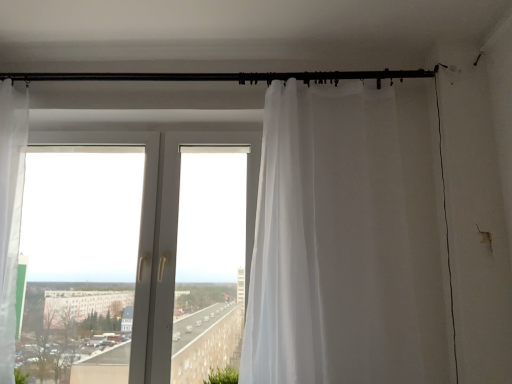
Question: Would you consider sheer white curtain at right to be distant from black metal rod at upper center?

Choices:
 (A) yes
 (B) no

Answer: (B)

Question: Can you confirm if sheer white curtain at right is smaller than black metal rod at upper center?

Choices:
 (A) yes
 (B) no

Answer: (B)

Question: Is sheer white curtain at right beside black metal rod at upper center?

Choices:
 (A) yes
 (B) no

Answer: (B)

Question: From the image's perspective, is sheer white curtain at right on top of black metal rod at upper center?

Choices:
 (A) yes
 (B) no

Answer: (B)

Question: Is sheer white curtain at right oriented away from black metal rod at upper center?

Choices:
 (A) no
 (B) yes

Answer: (A)

Question: Considering the positions of black metal rod at upper center and green leafy plant at lower left in the image, is black metal rod at upper center bigger or smaller than green leafy plant at lower left?

Choices:
 (A) big
 (B) small

Answer: (A)

Question: In terms of width, does black metal rod at upper center look wider or thinner when compared to green leafy plant at lower left?

Choices:
 (A) wide
 (B) thin

Answer: (B)

Question: Considering the relative positions of black metal rod at upper center and green leafy plant at lower left in the image provided, is black metal rod at upper center to the left or to the right of green leafy plant at lower left?

Choices:
 (A) right
 (B) left

Answer: (A)

Question: From the image's perspective, is black metal rod at upper center positioned above or below green leafy plant at lower left?

Choices:
 (A) above
 (B) below

Answer: (A)

Question: Is point (18, 374) positioned closer to the camera than point (96, 77)?

Choices:
 (A) farther
 (B) closer

Answer: (B)

Question: From their relative heights in the image, would you say green leafy plant at lower left is taller or shorter than black metal rod at upper center?

Choices:
 (A) tall
 (B) short

Answer: (A)

Question: Choose the correct answer: Is green leafy plant at lower left inside black metal rod at upper center or outside it?

Choices:
 (A) inside
 (B) outside

Answer: (B)

Question: Considering their positions, is green leafy plant at lower left located in front of or behind black metal rod at upper center?

Choices:
 (A) behind
 (B) front

Answer: (B)

Question: Considering their positions, is black metal rod at upper center located in front of or behind sheer white curtain at right?

Choices:
 (A) front
 (B) behind

Answer: (B)

Question: In terms of height, does black metal rod at upper center look taller or shorter compared to sheer white curtain at right?

Choices:
 (A) short
 (B) tall

Answer: (A)